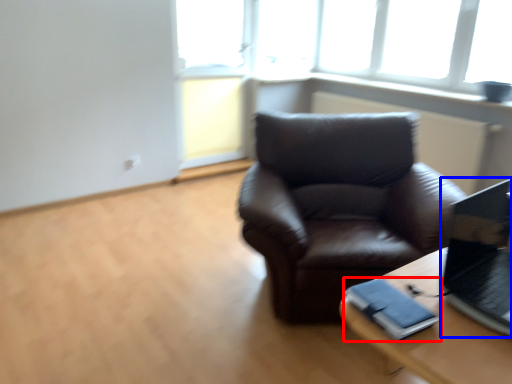
Question: Which point is further to the camera, binder (highlighted by a red box) or laptop (highlighted by a blue box)?

Choices:
 (A) binder
 (B) laptop

Answer: (A)